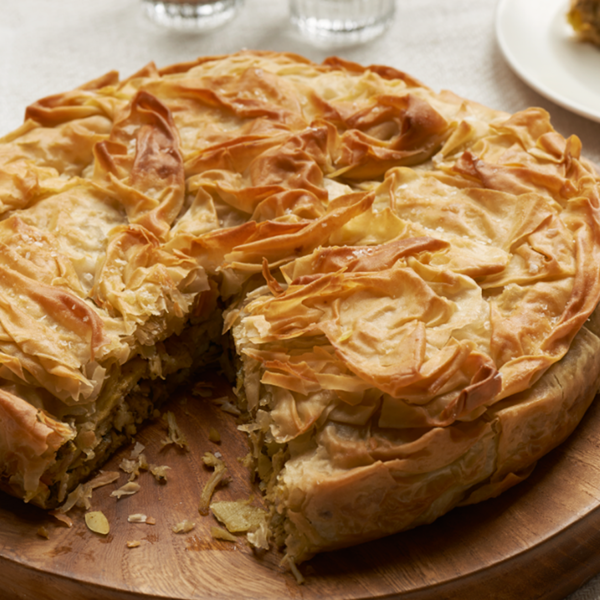
Where is `cutting board`? cutting board is located at coordinates (168, 527).